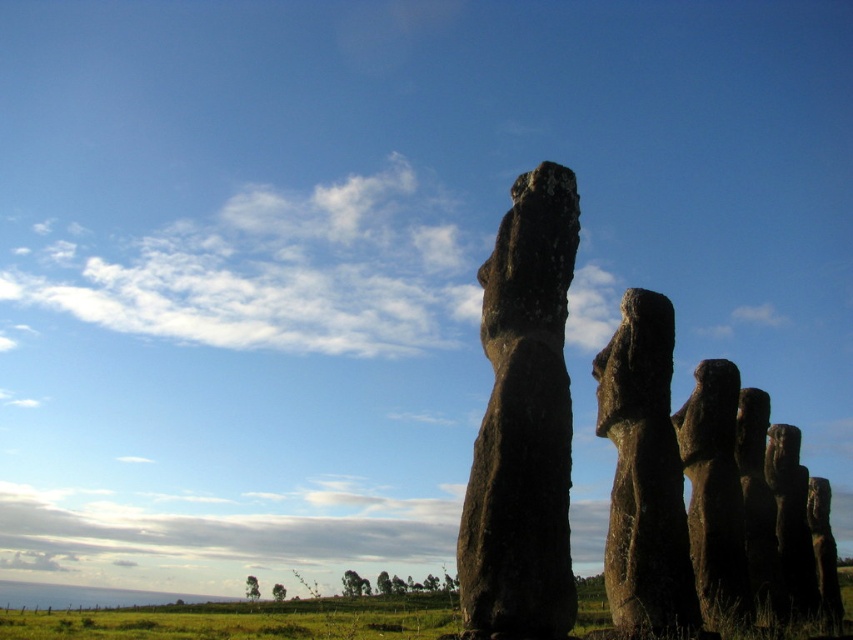
Question: Among these points, which one is farthest from the camera?

Choices:
 (A) (614, 589)
 (B) (517, 282)

Answer: (A)

Question: Is rough stone statue at center above dark brown stone statue at right?

Choices:
 (A) yes
 (B) no

Answer: (A)

Question: Among these points, which one is nearest to the camera?

Choices:
 (A) (642, 305)
 (B) (547, 372)

Answer: (B)

Question: Can you confirm if rough stone statue at center is smaller than dark brown stone statue at right?

Choices:
 (A) no
 (B) yes

Answer: (A)

Question: Which point appears farthest from the camera in this image?

Choices:
 (A) (636, 321)
 (B) (538, 305)

Answer: (A)

Question: Can you confirm if rough stone statue at center is wider than dark brown stone statue at right?

Choices:
 (A) no
 (B) yes

Answer: (B)